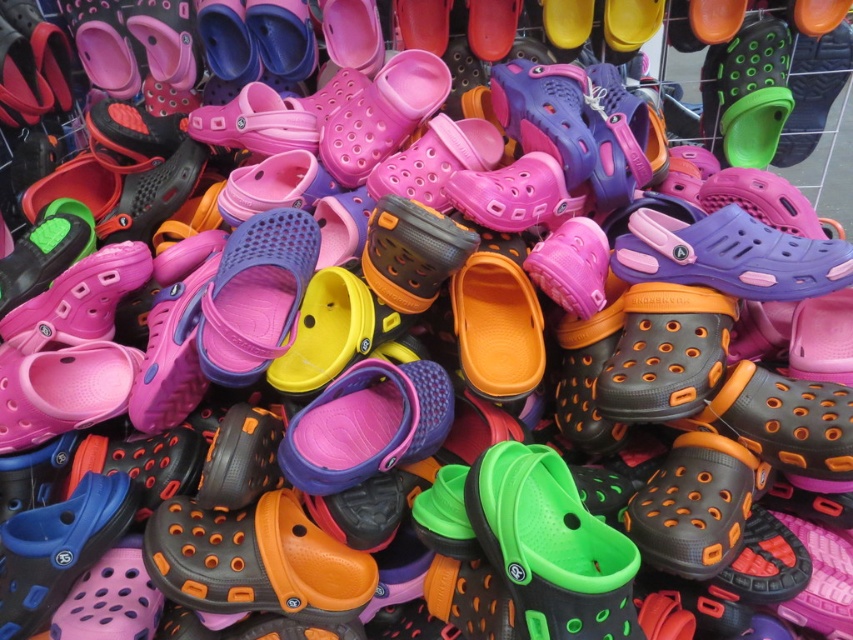
You are a customer at a Crocs store and want to pick up the orange matte clog at center and the green rubber clog at center. Which one should you reach for first if you want to grab the one on the left?

The orange matte clog at center is on the left, so you should reach for it first.

You are a customer at a Crocs store and want to know if the green rubber clog at center and the orange matte clog at center are close enough to be picked up together without moving either one. The store requires that items must be within 10 inches of each other to be considered adjacent. Can you determine if they qualify?

The green rubber clog at center is 10.62 inches from the orange matte clog at center, which exceeds the 10 inch requirement. Therefore, they are not close enough to be considered adjacent and must be picked up separately.

You are a customer at a Crocs store trying to find a pair of clogs. You see the green rubber clog at center and the orange matte clog at center. Which one is placed higher in the display?

The green rubber clog at center is placed higher than the orange matte clog at center because it is positioned above it in the display.